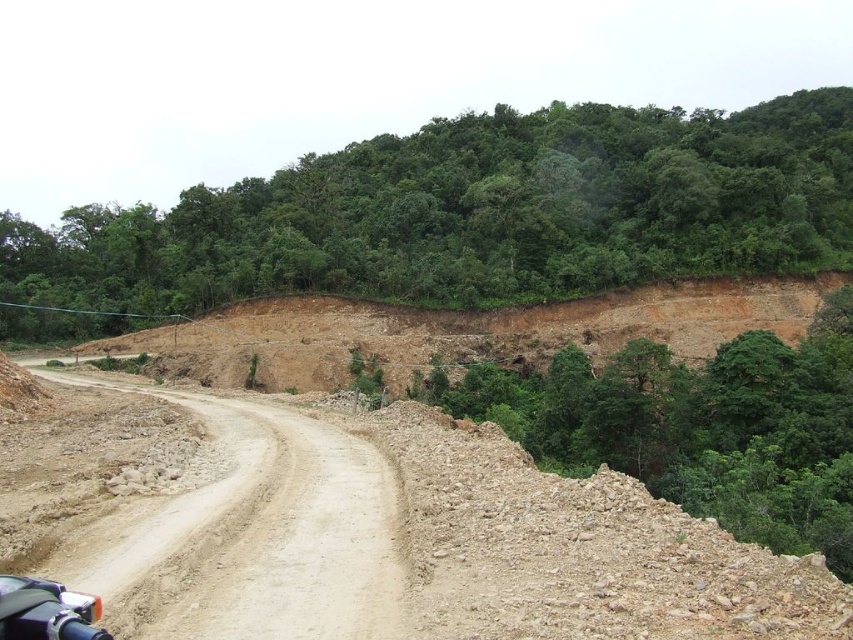
Is green leafy trees at upper center positioned before dirt/gravel road at center?

No, it is behind dirt/gravel road at center.

Can you confirm if green leafy trees at upper center is smaller than dirt/gravel road at center?

Actually, green leafy trees at upper center might be larger than dirt/gravel road at center.

Does point (573, 225) come in front of point (97, 540)?

No, (573, 225) is further to viewer.

This screenshot has height=640, width=853. I want to click on green leafy trees at upper center, so coord(474,212).